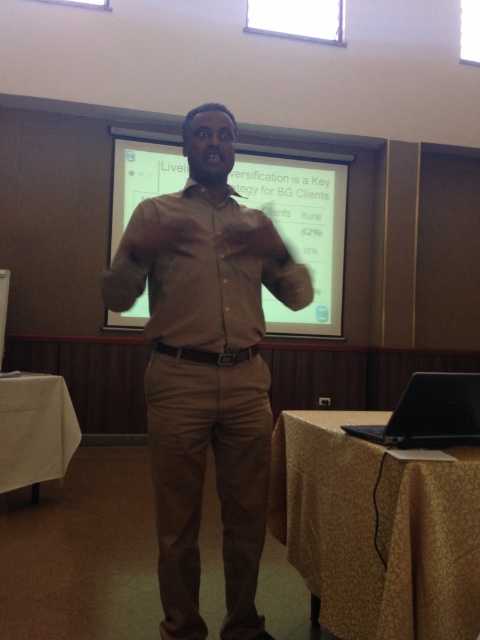
Question: Is white cloth at lower left thinner than black matte laptop at lower right?

Choices:
 (A) no
 (B) yes

Answer: (A)

Question: In this image, where is yellow fabric table at lower right located relative to white cloth at lower left?

Choices:
 (A) right
 (B) left

Answer: (A)

Question: Based on their relative distances, which object is nearer to the matte khaki shirt at center?

Choices:
 (A) yellow fabric table at lower right
 (B) white cloth at lower left

Answer: (A)

Question: Is matte khaki shirt at center wider than black matte laptop at lower right?

Choices:
 (A) yes
 (B) no

Answer: (A)

Question: Which point is closer to the camera?

Choices:
 (A) black matte laptop at lower right
 (B) white matte projection screen at upper center
 (C) matte khaki shirt at center

Answer: (A)

Question: Which point is farther from the camera taking this photo?

Choices:
 (A) (265, 636)
 (B) (339, 205)
 (C) (36, 436)

Answer: (B)